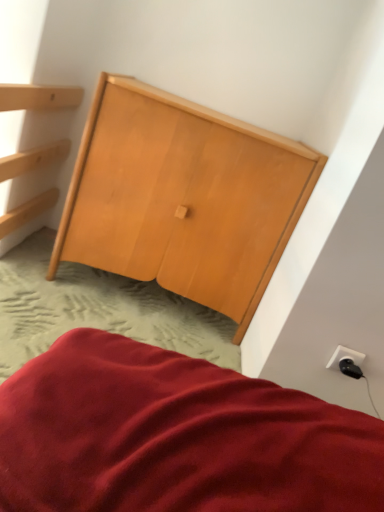
You are a GUI agent. You are given a task and a screenshot of the screen. Output one action in this format:
    pyautogui.click(x=<x>, y=<y>)
    Task: Click on the white plastic outlet at lower right
    
    Given the screenshot: What is the action you would take?
    pyautogui.click(x=347, y=361)

Where is `white plastic outlet at lower right`? The height and width of the screenshot is (512, 384). white plastic outlet at lower right is located at coordinates (347, 361).

From the image's perspective, which is above, natural wood wardrobe at center or white plastic outlet at lower right?

natural wood wardrobe at center appears higher in the image.

Does natural wood wardrobe at center have a greater width compared to white plastic outlet at lower right?

Yes.

How different are the orientations of natural wood wardrobe at center and white plastic outlet at lower right in degrees?

The angular difference between natural wood wardrobe at center and white plastic outlet at lower right is 0.00712 degrees.

Consider the image. Can you confirm if natural wood wardrobe at center is positioned to the right of white plastic outlet at lower right?

In fact, natural wood wardrobe at center is to the left of white plastic outlet at lower right.

Is natural wood wardrobe at center next to black plastic plug at lower right and touching it?

natural wood wardrobe at center is not next to black plastic plug at lower right, and they're not touching.

Is natural wood wardrobe at center positioned with its back to black plastic plug at lower right?

No, natural wood wardrobe at center's orientation is not away from black plastic plug at lower right.

Considering the sizes of natural wood wardrobe at center and black plastic plug at lower right in the image, is natural wood wardrobe at center wider or thinner than black plastic plug at lower right?

In the image, natural wood wardrobe at center appears to be wider than black plastic plug at lower right.

Who is shorter, natural wood wardrobe at center or black plastic plug at lower right?

With less height is black plastic plug at lower right.

You are a GUI agent. You are given a task and a screenshot of the screen. Output one action in this format:
    pyautogui.click(x=<x>, y=<y>)
    Task: Click on the furniture on the left of black plastic plug at lower right
    Image resolution: width=384 pixels, height=512 pixels.
    Given the screenshot: What is the action you would take?
    pyautogui.click(x=183, y=197)

Is black plastic plug at lower right to the right of natural wood wardrobe at center from the viewer's perspective?

Indeed, black plastic plug at lower right is positioned on the right side of natural wood wardrobe at center.

Between black plastic plug at lower right and natural wood wardrobe at center, which one has less height?

black plastic plug at lower right.

Is black plastic plug at lower right turned away from natural wood wardrobe at center?

No.

Is black plastic plug at lower right located outside white plastic outlet at lower right?

Absolutely, black plastic plug at lower right is external to white plastic outlet at lower right.

Looking at the image, does black plastic plug at lower right seem bigger or smaller compared to white plastic outlet at lower right?

black plastic plug at lower right is smaller than white plastic outlet at lower right.

From the image's perspective, is black plastic plug at lower right on top of white plastic outlet at lower right?

No.

Is point (354, 369) positioned after point (353, 364)?

Yes, point (354, 369) is behind point (353, 364).

Between point (353, 370) and point (284, 248), which one is positioned behind?

The point (284, 248) is farther.

In order to click on furniture that appears on the left of white plastic outlet at lower right in this screenshot , I will do `click(183, 197)`.

Can you tell me how much white plastic outlet at lower right and natural wood wardrobe at center differ in facing direction?

white plastic outlet at lower right and natural wood wardrobe at center are facing 0.00712 degrees away from each other.

Does point (352, 362) lie behind point (344, 368)?

No, (352, 362) is closer to viewer.

Is white plastic outlet at lower right looking in the opposite direction of black plastic plug at lower right?

Yes, white plastic outlet at lower right is facing away from black plastic plug at lower right.

Identify the location of plug directly beneath the white plastic outlet at lower right (from a real-world perspective). (350, 368).

How different are the orientations of white plastic outlet at lower right and black plastic plug at lower right in degrees?

The facing directions of white plastic outlet at lower right and black plastic plug at lower right are 0.00283 degrees apart.

The height and width of the screenshot is (512, 384). In the image, there is a natural wood wardrobe at center. What are the coordinates of `electric outlet below it (from the image's perspective)` in the screenshot? It's located at (347, 361).

I want to click on plug on the right side of natural wood wardrobe at center, so click(x=350, y=368).

Consider the image. From the image, which object appears to be farther from natural wood wardrobe at center, white plastic outlet at lower right or black plastic plug at lower right?

The object further to natural wood wardrobe at center is black plastic plug at lower right.

Looking at the image, which one is located closer to black plastic plug at lower right, white plastic outlet at lower right or natural wood wardrobe at center?

white plastic outlet at lower right lies closer to black plastic plug at lower right than the other object.

Looking at this image, estimate the real-world distances between objects in this image. Which object is closer to black plastic plug at lower right, natural wood wardrobe at center or white plastic outlet at lower right?

Based on the image, white plastic outlet at lower right appears to be nearer to black plastic plug at lower right.

Looking at the image, which one is located further to white plastic outlet at lower right, black plastic plug at lower right or natural wood wardrobe at center?

natural wood wardrobe at center lies further to white plastic outlet at lower right than the other object.

Based on the photo, which object lies nearer to the anchor point natural wood wardrobe at center, black plastic plug at lower right or white plastic outlet at lower right?

white plastic outlet at lower right lies closer to natural wood wardrobe at center than the other object.

Which object lies further to the anchor point white plastic outlet at lower right, natural wood wardrobe at center or black plastic plug at lower right?

Among the two, natural wood wardrobe at center is located further to white plastic outlet at lower right.

The width and height of the screenshot is (384, 512). Identify the location of electric outlet between natural wood wardrobe at center and black plastic plug at lower right in the up-down direction. (347, 361).